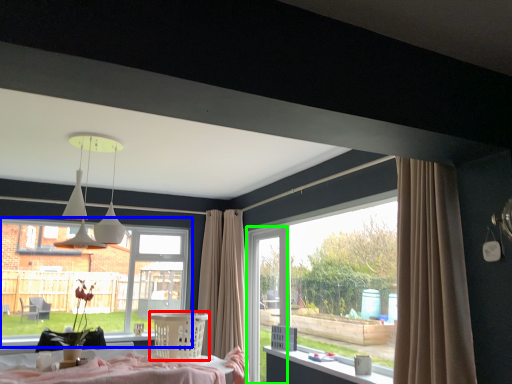
Question: Which is farther away from furniture (highlighted by a red box)? window (highlighted by a blue box) or screen door (highlighted by a green box)?

Choices:
 (A) window
 (B) screen door

Answer: (B)